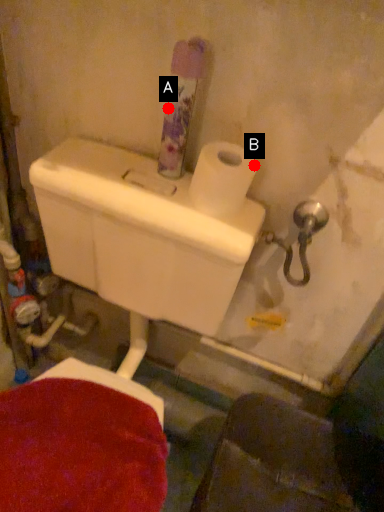
Question: Two points are circled on the image, labeled by A and B beside each circle. Which point is closer to the camera?

Choices:
 (A) A is closer
 (B) B is closer

Answer: (A)